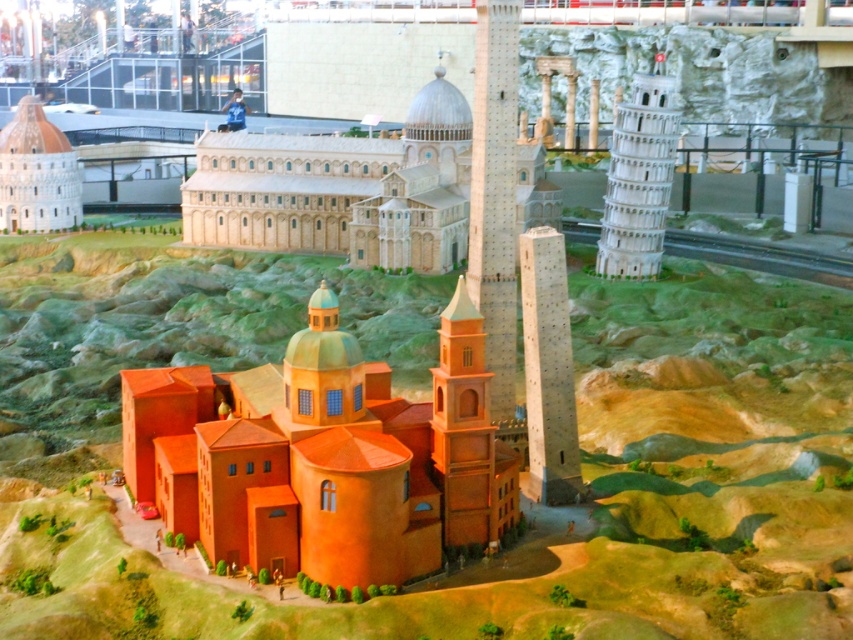
Question: Which object is farther from the camera taking this photo?

Choices:
 (A) orange clay terrain at center
 (B) orange clay tower at center

Answer: (B)

Question: Is smooth stone tower at center closer to the viewer compared to orange clay tower at center?

Choices:
 (A) yes
 (B) no

Answer: (B)

Question: Which of the following is the farthest from the observer?

Choices:
 (A) (7, 221)
 (B) (498, 506)
 (C) (422, 230)
 (D) (547, 496)

Answer: (A)

Question: Is light brown stone church at center to the left of smooth stone tower at center from the viewer's perspective?

Choices:
 (A) yes
 (B) no

Answer: (A)

Question: Considering the relative positions of light brown stone church at center and white stone tower at right in the image provided, where is light brown stone church at center located with respect to white stone tower at right?

Choices:
 (A) below
 (B) above

Answer: (A)

Question: Which point appears farthest from the camera in this image?

Choices:
 (A) (537, 358)
 (B) (718, 296)
 (C) (25, 204)
 (D) (599, 250)

Answer: (C)